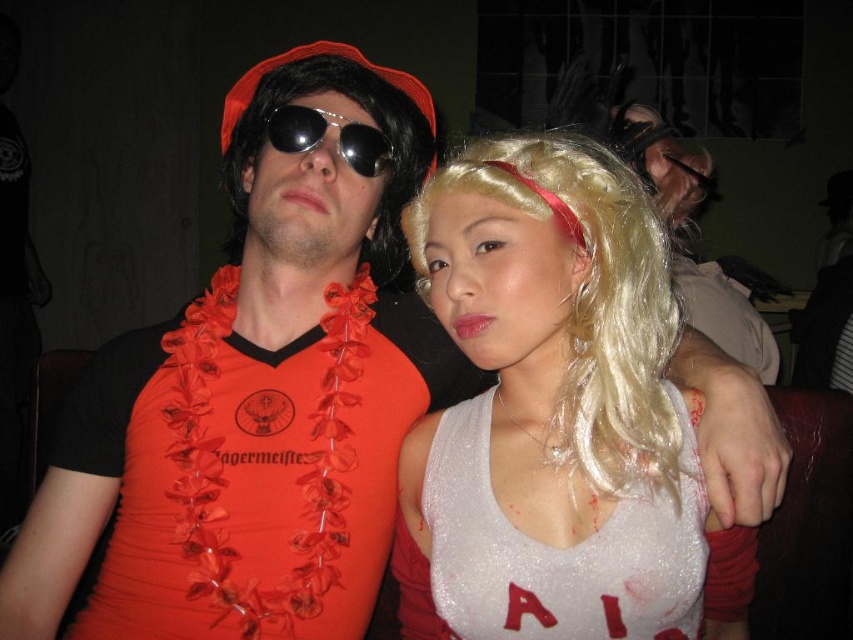
You are taking a photo of two people in the scene. You want to focus on the point closer to the camera. Which point should you choose between point (543, 541) and point (659, 182)?

Point (543, 541) is closer to the camera than point (659, 182), so you should choose point (543, 541) to focus on.

You are a photographer at a party and want to capture the matte black wig at upper right in your shot. The camera has a rectangular viewfinder with a width of 0.8 and height of 0.6. The viewfinder is positioned such that its bottom left corner is at coordinate point 0.0, 0.0 and its top right corner is at coordinate point 1.0, 1.0. You want to adjust the camera so that the point (724, 314) is centered in the viewfinder. What are the new coordinates of the bottom left and top right corners of the viewfider

The point (724, 314) is the center of the viewfinder. The viewfinder has a width of 0.8 and height of 0.6. To find the new bottom left corner, subtract half the width and half the height from the center coordinates. Half the width is 0.4 and half the height is 0.3. Subtracting these from the center coordinates gives the bottom left corner at 0.492 minus 0.4 equals 0.092, and 0.851 minus 0.3 equals 0.551. The top right corner is the center plus half the width and height, so 0.492 plus 0.4 equals 0.892 and

You are a photographer setting up for a photoshoot and need to adjust the lighting to ensure both the matte black wig at upper right and the metallic aviator sunglasses at center are well lit. Considering their sizes, which object requires a larger spotlight to capture its details?

The matte black wig at upper right requires a larger spotlight because it has a greater height than the metallic aviator sunglasses at center, meaning it needs more light coverage to capture all details.